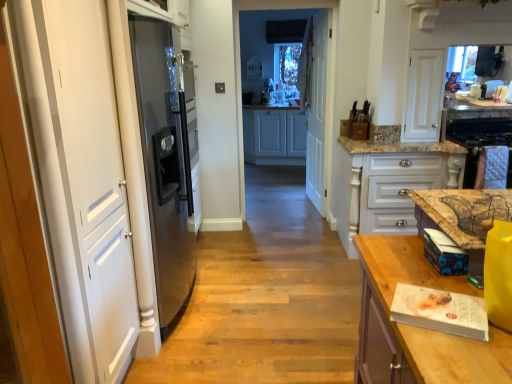
Question: Considering the relative sizes of quilted fabric oven at right and white wood cabinets at center, the first cabinetry viewed from the left, in the image provided, is quilted fabric oven at right taller than white wood cabinets at center, the first cabinetry viewed from the left,?

Choices:
 (A) yes
 (B) no

Answer: (B)

Question: Does quilted fabric oven at right turn towards white wood cabinets at center, the first cabinetry viewed from the left?

Choices:
 (A) no
 (B) yes

Answer: (A)

Question: Can you confirm if quilted fabric oven at right is shorter than white wood cabinets at center, the first cabinetry viewed from the left?

Choices:
 (A) no
 (B) yes

Answer: (B)

Question: Can white wood cabinets at center, marked as the 2th cabinetry in a bottom-to-top arrangement, be found inside quilted fabric oven at right?

Choices:
 (A) no
 (B) yes

Answer: (A)

Question: Does quilted fabric oven at right appear on the left side of white wood cabinets at center, the first cabinetry viewed from the left?

Choices:
 (A) yes
 (B) no

Answer: (B)

Question: In the image, is white glossy cabinet at center, arranged as the first cabinetry when ordered from the bottom, positioned in front of or behind white wooden door at center?

Choices:
 (A) behind
 (B) front

Answer: (B)

Question: In terms of size, does white glossy cabinet at center, which appears as the second cabinetry when viewed from the left, appear bigger or smaller than white wooden door at center?

Choices:
 (A) small
 (B) big

Answer: (B)

Question: Is point (366, 155) closer or farther from the camera than point (323, 196)?

Choices:
 (A) farther
 (B) closer

Answer: (B)

Question: Is white glossy cabinet at center, which appears as the second cabinetry when viewed from the left, wider or thinner than white wooden door at center?

Choices:
 (A) wide
 (B) thin

Answer: (A)

Question: From the image's perspective, relative to quilted fabric oven at right, is white wood cabinets at center, the first cabinetry in the top-to-bottom sequence, above or below?

Choices:
 (A) above
 (B) below

Answer: (A)

Question: From a real-world perspective, is white wood cabinets at center, which appears as the 2th cabinetry when viewed from the front, positioned above or below quilted fabric oven at right?

Choices:
 (A) above
 (B) below

Answer: (B)

Question: Based on their positions, is white wood cabinets at center, the first cabinetry in the top-to-bottom sequence, located to the left or right of quilted fabric oven at right?

Choices:
 (A) right
 (B) left

Answer: (B)

Question: Considering the positions of white wood cabinets at center, which appears as the second cabinetry when viewed from the right, and quilted fabric oven at right in the image, is white wood cabinets at center, which appears as the second cabinetry when viewed from the right, bigger or smaller than quilted fabric oven at right?

Choices:
 (A) big
 (B) small

Answer: (A)

Question: Does point click(x=306, y=160) appear closer or farther from the camera than point click(x=403, y=150)?

Choices:
 (A) farther
 (B) closer

Answer: (A)

Question: In terms of height, does white wooden door at center look taller or shorter compared to white glossy cabinet at center, the first cabinetry positioned from the right?

Choices:
 (A) short
 (B) tall

Answer: (B)